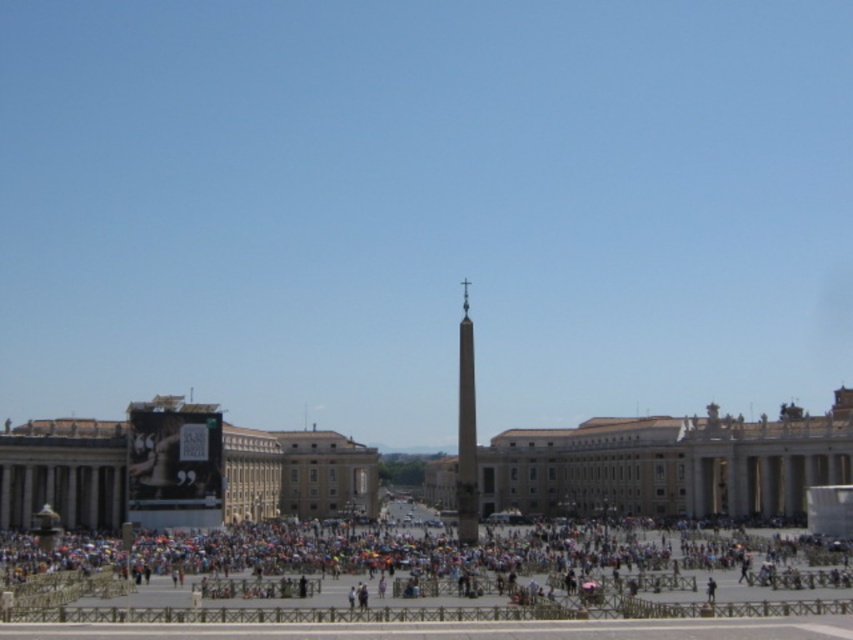
Looking at this image, you are a photographer standing in the public square and want to capture both the multicolored fabric crowd at lower center and the polished stone obelisk at center in a single photo. Which object will appear larger in your photo?

The multicolored fabric crowd at lower center will appear larger in the photo because it is closer to the viewer than the polished stone obelisk at center.

You are a photographer standing at the edge of the square. You want to capture a photo of the polished stone obelisk at center without the multicolored fabric crowd at lower center appearing in the frame. Which direction should you move to achieve this?

Since the multicolored fabric crowd at lower center is positioned on the left side of the polished stone obelisk at center, you should move to the right side of the obelisk to avoid including the crowd in your photo.

You are a photographer standing at the edge of the square and want to capture both the multicolored fabric crowd at lower center and the polished stone obelisk at center in the same frame. Based on their positions, will you need to adjust your camera angle upwards or downwards to include both subjects?

The multicolored fabric crowd at lower center is located below the polished stone obelisk at center. To include both in the frame, you would need to adjust your camera angle upwards to capture the obelisk at center while still including the crowd below.